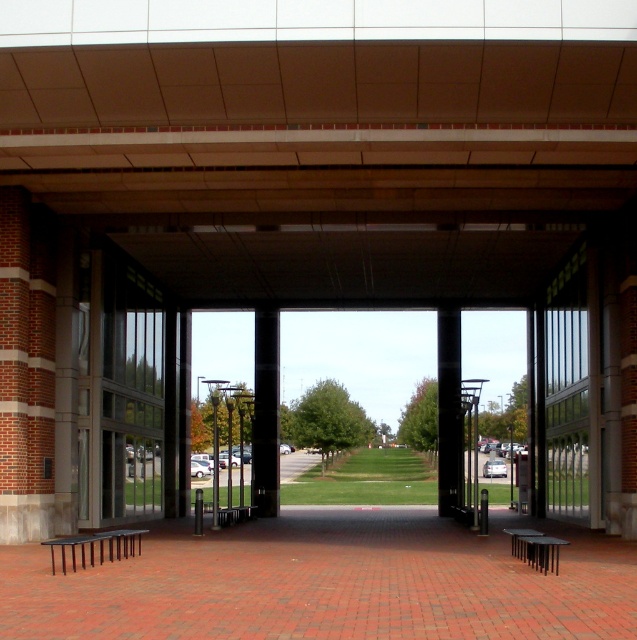
You are standing at the entrance of the covered walkway and want to take a photo of both the point at coordinates (x=255, y=490) and the point at coordinates (x=447, y=410). Which point will appear larger in your photo?

The point at coordinates (x=255, y=490) will appear larger in the photo because it is closer to the camera than the point at coordinates (x=447, y=410).

You are an architect designing a new walkway and want to ensure that the columns and pillars are proportionate. Given the black glossy column at center and the black smooth pillar at center in the image, which one is shorter?

The black glossy column at center is shorter than the black smooth pillar at center.